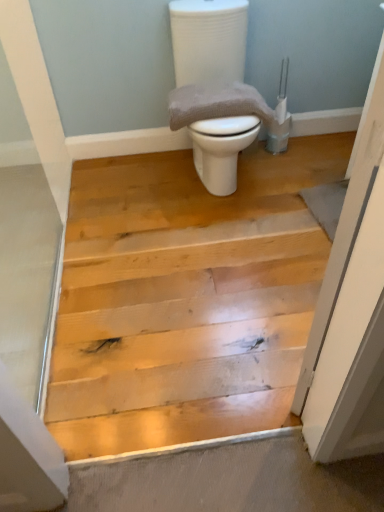
Question: From their relative heights in the image, would you say gray textured towel at center is taller or shorter than white glossy toilet at center?

Choices:
 (A) tall
 (B) short

Answer: (B)

Question: From the image's perspective, is gray textured towel at center located above or below white glossy toilet at center?

Choices:
 (A) above
 (B) below

Answer: (B)

Question: In terms of size, does gray textured towel at center appear bigger or smaller than white glossy toilet at center?

Choices:
 (A) big
 (B) small

Answer: (B)

Question: Does point (188, 11) appear closer or farther from the camera than point (173, 90)?

Choices:
 (A) farther
 (B) closer

Answer: (B)

Question: From the image's perspective, relative to gray textured towel at center, is white glossy toilet at center above or below?

Choices:
 (A) below
 (B) above

Answer: (B)

Question: Considering the positions of white glossy toilet at center and gray textured towel at center in the image, is white glossy toilet at center bigger or smaller than gray textured towel at center?

Choices:
 (A) small
 (B) big

Answer: (B)

Question: Is white glossy toilet at center to the left or to the right of gray textured towel at center in the image?

Choices:
 (A) right
 (B) left

Answer: (A)